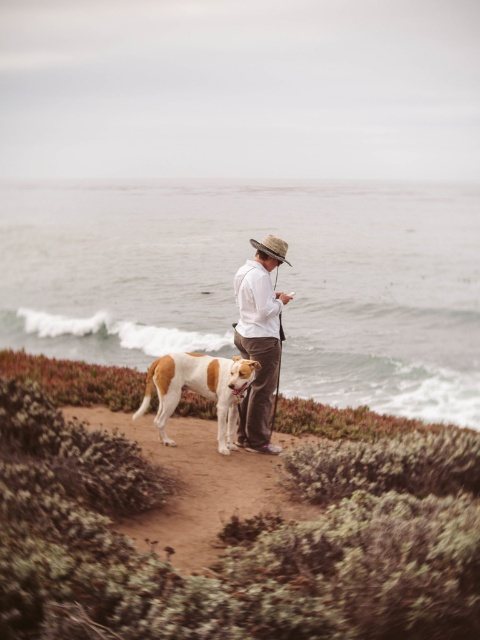
Consider the image. Is brown dirt path at center positioned behind white cotton shirt at center?

No, it is not.

Which is in front, point (256, 509) or point (252, 332)?

Positioned in front is point (256, 509).

Which is in front, point (211, 509) or point (268, 419)?

Point (211, 509)

Identify the location of brown dirt path at center. (195, 484).

Is point (166, 445) closer to camera compared to point (266, 243)?

Yes, point (166, 445) is in front of point (266, 243).

What do you see at coordinates (195, 484) in the screenshot? I see `brown dirt path at center` at bounding box center [195, 484].

Find the location of a particular element. The image size is (480, 640). brown dirt path at center is located at coordinates (195, 484).

Is point (144, 442) behind point (195, 376)?

That is True.

Describe the element at coordinates (195, 484) in the screenshot. The image size is (480, 640). I see `brown dirt path at center` at that location.

Image resolution: width=480 pixels, height=640 pixels. In order to click on brown dirt path at center in this screenshot , I will do `click(195, 484)`.